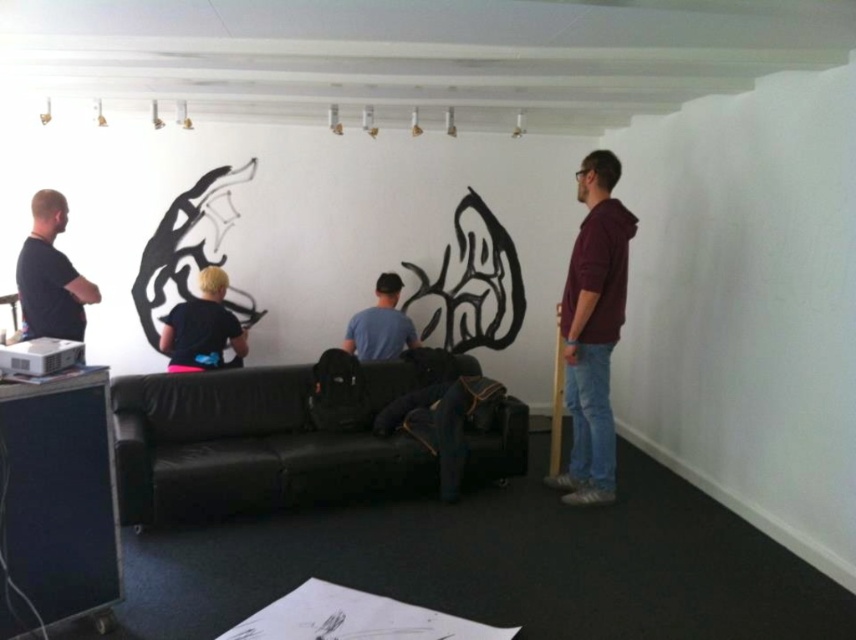
Question: Does black matte shirt at left appear over matte blue shirt at center?

Choices:
 (A) yes
 (B) no

Answer: (A)

Question: Which object is the farthest from the blonde hair person at center?

Choices:
 (A) maroon hoodie at right
 (B) black matte shirt at left
 (C) matte blue shirt at center

Answer: (A)

Question: Observing the image, what is the correct spatial positioning of maroon hoodie at right in reference to black matte shirt at left?

Choices:
 (A) left
 (B) right

Answer: (B)

Question: Which of these objects is positioned closest to the black leather couch at center?

Choices:
 (A) black matte shirt at left
 (B) matte blue shirt at center
 (C) blonde hair person at center

Answer: (B)

Question: Does blonde hair person at center have a greater width compared to matte blue shirt at center?

Choices:
 (A) no
 (B) yes

Answer: (B)

Question: Which point is farther to the camera?

Choices:
 (A) (207, 365)
 (B) (604, 461)

Answer: (A)